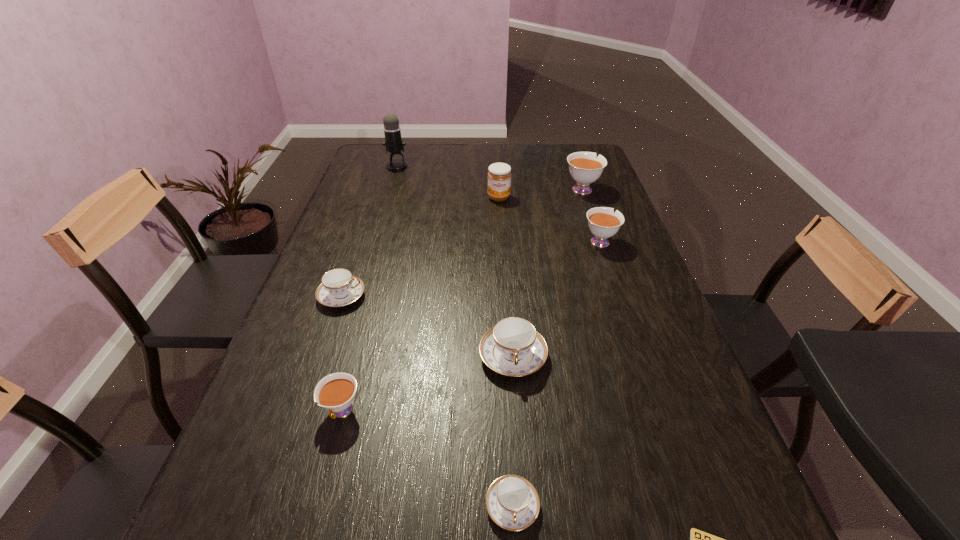
The image size is (960, 540). What are the coordinates of `the farthest object` in the screenshot? It's located at (393, 142).

Where is `microphone`? microphone is located at coordinates (393, 142).

You are a GUI agent. You are given a task and a screenshot of the screen. Output one action in this format:
    pyautogui.click(x=<x>, y=<y>)
    Task: Click on the biggest white teacup
    
    Given the screenshot: What is the action you would take?
    pyautogui.click(x=585, y=168)

Identify the location of the farthest white teacup. The width and height of the screenshot is (960, 540). (585, 168).

The image size is (960, 540). Identify the location of jam. (499, 176).

At what (x,y) coordinates should I click in order to perform the action: click on the second biggest white teacup. Please return your answer as a coordinate pair (x, y). Looking at the image, I should click on (603, 223).

Locate an element on the screen. This screenshot has width=960, height=540. the fifth nearest teacup is located at coordinates pos(603,223).

Where is `the second farthest blue teacup`? the second farthest blue teacup is located at coordinates (513, 347).

The height and width of the screenshot is (540, 960). I want to click on the biggest blue teacup, so click(513, 347).

This screenshot has width=960, height=540. Find the location of `the second nearest teacup`. the second nearest teacup is located at coordinates (335, 392).